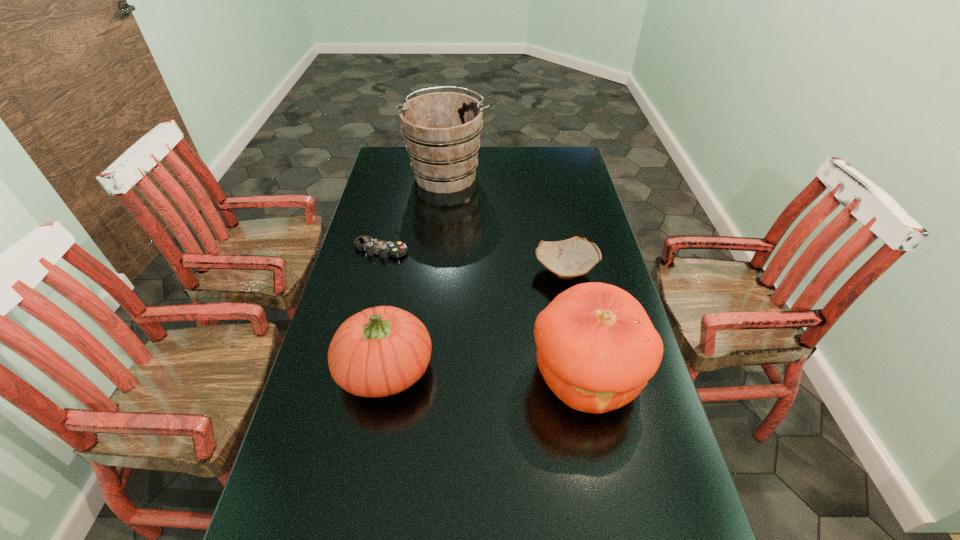
Find the location of a particular element. vacant area located 0.050m on the left of the pottery is located at coordinates (518, 272).

Identify the location of vacant space situated on the back of the control. (390, 213).

The height and width of the screenshot is (540, 960). In order to click on object situated at the far edge in this screenshot , I will do `click(442, 130)`.

Locate an element on the screen. The image size is (960, 540). bucket that is at the left edge is located at coordinates (442, 130).

What are the coordinates of `pumpkin located at the left edge` in the screenshot? It's located at (380, 351).

Image resolution: width=960 pixels, height=540 pixels. In order to click on control positioned at the left edge in this screenshot , I will do `click(384, 249)`.

Where is `pumpkin located at the right edge`? pumpkin located at the right edge is located at coordinates (596, 347).

The height and width of the screenshot is (540, 960). In order to click on pottery that is at the right edge in this screenshot , I will do `click(570, 258)`.

At what (x,y) coordinates should I click in order to perform the action: click on object at the far left corner. Please return your answer as a coordinate pair (x, y). Looking at the image, I should click on (442, 130).

Find the location of a particular element. The image size is (960, 540). free space at the far edge of the desktop is located at coordinates (534, 172).